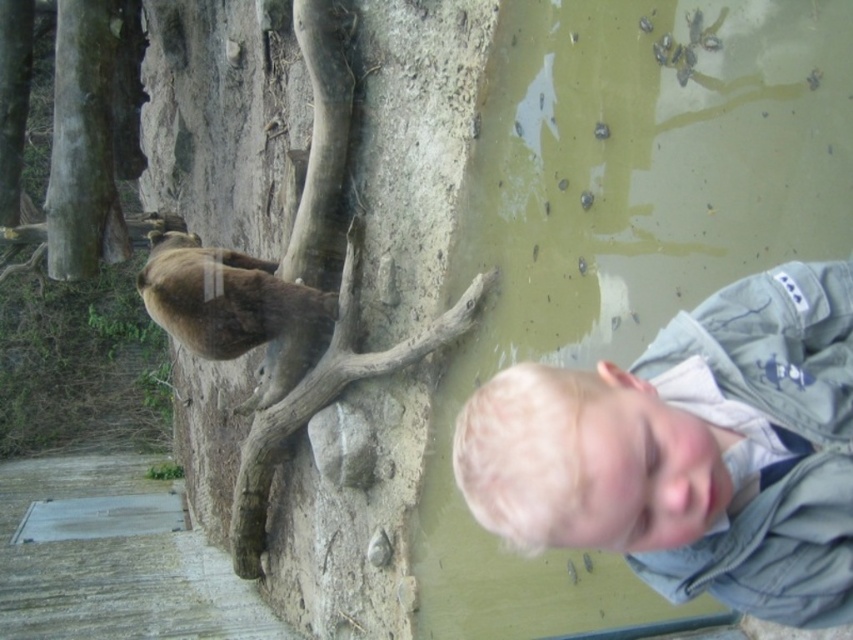
You are a visitor at the zoo and want to take a photo of the brown furry bear at upper left without any obstructions. Is the blonde hair at lower right blocking your view of the bear?

The blonde hair at lower right is in front of the brown furry bear at upper left, so it is blocking the view of the bear. Move to a different angle to avoid the obstruction.

You are a zookeeper who needs to place a 3.5 meter long ladder to reach the brown rough bark tree at upper left for maintenance. Can the ladder reach the tree from your current position in front of the camera?

The distance between the brown rough bark tree at upper left and the camera is 3.62 meters. Since the ladder is 3.5 meters long, it is slightly shorter than the required distance. Therefore, the ladder cannot reach the tree from the camera position.

You are standing in a zoo exhibit and see two points marked in the image. The first point is at coordinate point (x=410, y=116) and the second is at point (x=260, y=333). Which point is closer to you?

Point (x=410, y=116) is closer to the viewer than point (x=260, y=333).